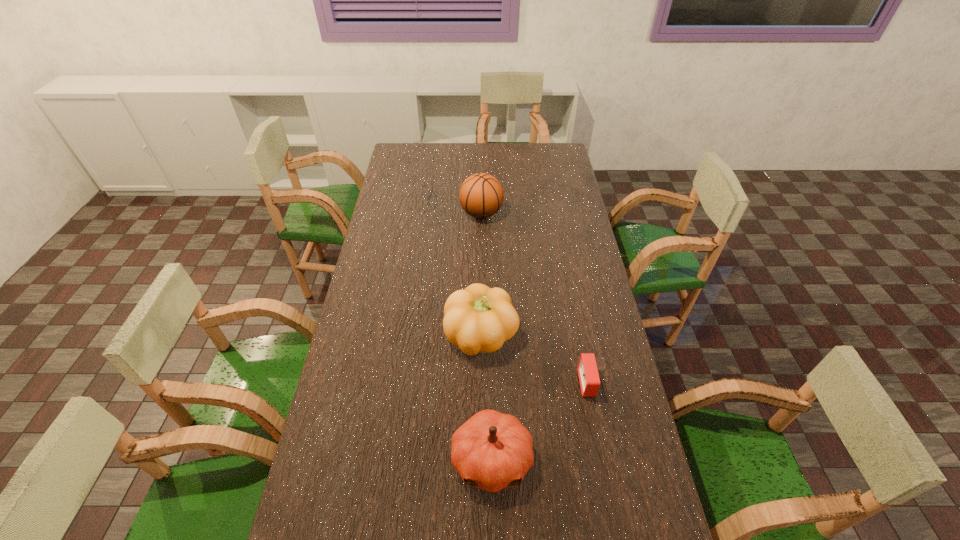
This screenshot has width=960, height=540. Find the location of `free space that is in between the farther pumpkin and the nearest object`. free space that is in between the farther pumpkin and the nearest object is located at coordinates (487, 397).

Where is `vacant area between the nearest object and the rightmost object`? The image size is (960, 540). vacant area between the nearest object and the rightmost object is located at coordinates (540, 421).

This screenshot has height=540, width=960. Identify the location of object that can be found as the third closest to the farther pumpkin. (481, 195).

Find the location of a particular element. This screenshot has width=960, height=540. object that stands as the second closest to the farthest object is located at coordinates coord(587,368).

What are the coordinates of `vacant space that satisfies the following two spatial constraints: 1. on the front-facing side of the alarm clock; 2. on the front-facing side of the nearest object` in the screenshot? It's located at (602, 460).

At what (x,y) coordinates should I click in order to perform the action: click on free spot that satisfies the following two spatial constraints: 1. on the front-facing side of the shortest object; 2. on the front-facing side of the nearer pumpkin. Please return your answer as a coordinate pair (x, y). The width and height of the screenshot is (960, 540). Looking at the image, I should click on (602, 460).